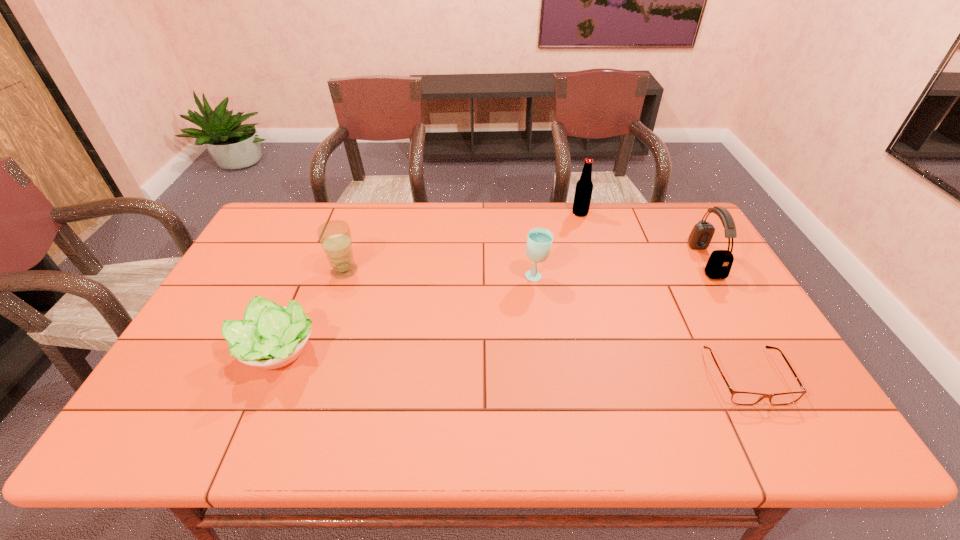
Find the location of `vacant space located 0.220m on the headband of the headset`. vacant space located 0.220m on the headband of the headset is located at coordinates (625, 261).

Find the location of a particular element. Image resolution: width=960 pixels, height=540 pixels. free space located on the front of the left glass is located at coordinates (306, 381).

Image resolution: width=960 pixels, height=540 pixels. I want to click on free space located 0.220m on the back of the right glass, so click(x=529, y=227).

Image resolution: width=960 pixels, height=540 pixels. Identify the location of vacant space located on the right of the lettuce. (404, 352).

I want to click on vacant space located 0.080m on the lenses of the spectacles, so click(780, 440).

Where is `beer bottle located at the far edge`? The height and width of the screenshot is (540, 960). beer bottle located at the far edge is located at coordinates (584, 187).

I want to click on headset that is at the far edge, so click(719, 264).

Locate an element on the screen. The image size is (960, 540). object present at the left edge is located at coordinates (270, 336).

Locate an element on the screen. headset at the right edge is located at coordinates (719, 264).

Locate an element on the screen. Image resolution: width=960 pixels, height=540 pixels. spectacles at the right edge is located at coordinates (738, 397).